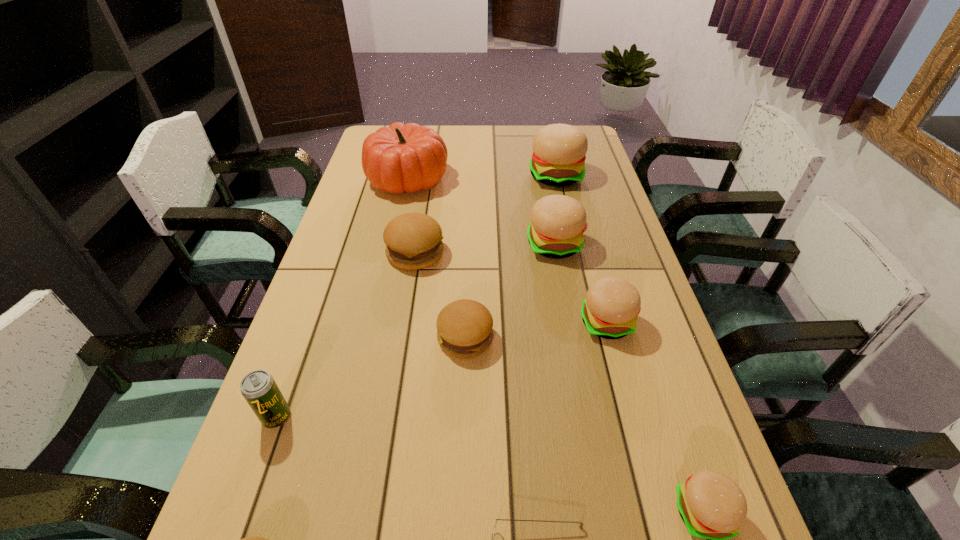
In the image, there is a desktop. Where is `free region at the far edge`? free region at the far edge is located at coordinates (504, 134).

Image resolution: width=960 pixels, height=540 pixels. I want to click on vacant region at the left edge of the desktop, so click(x=349, y=385).

You are a GUI agent. You are given a task and a screenshot of the screen. Output one action in this format:
    pyautogui.click(x=<x>, y=<y>)
    Task: Click on the vacant space at the right edge of the desktop
    The image size is (960, 540).
    Given the screenshot: What is the action you would take?
    pyautogui.click(x=675, y=532)

The image size is (960, 540). I want to click on unoccupied position between the pumpkin and the sixth shortest hamburger, so click(481, 212).

At what (x,y) coordinates should I click in order to perform the action: click on blank region between the third farthest beige hamburger and the farthest brown hamburger. Please return your answer as a coordinate pair (x, y). Looking at the image, I should click on (511, 288).

The width and height of the screenshot is (960, 540). Identify the location of empty space between the third biggest beige hamburger and the second hamburger from left to right. (511, 288).

Where is `vacant area that lies between the fourth nearest object and the pumpkin`? The height and width of the screenshot is (540, 960). vacant area that lies between the fourth nearest object and the pumpkin is located at coordinates (342, 298).

Where is `empty space between the second farthest beige hamburger and the second brown hamburger from right to left`? Image resolution: width=960 pixels, height=540 pixels. empty space between the second farthest beige hamburger and the second brown hamburger from right to left is located at coordinates (485, 249).

The image size is (960, 540). Find the location of `free space between the pumpkin and the farthest hamburger`. free space between the pumpkin and the farthest hamburger is located at coordinates (481, 178).

Identify the location of the seventh closest object to the tallest hamburger. (259, 389).